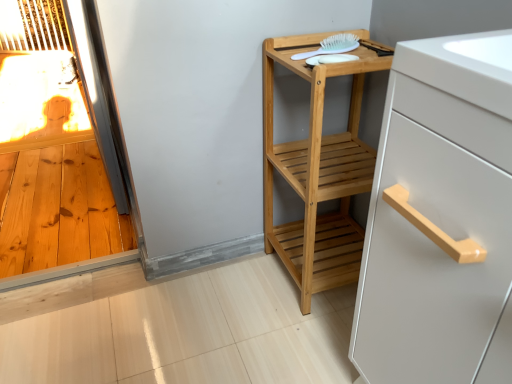
Locate an element on the screen. This screenshot has height=384, width=512. free space in front of white plastic brush at upper right is located at coordinates (341, 61).